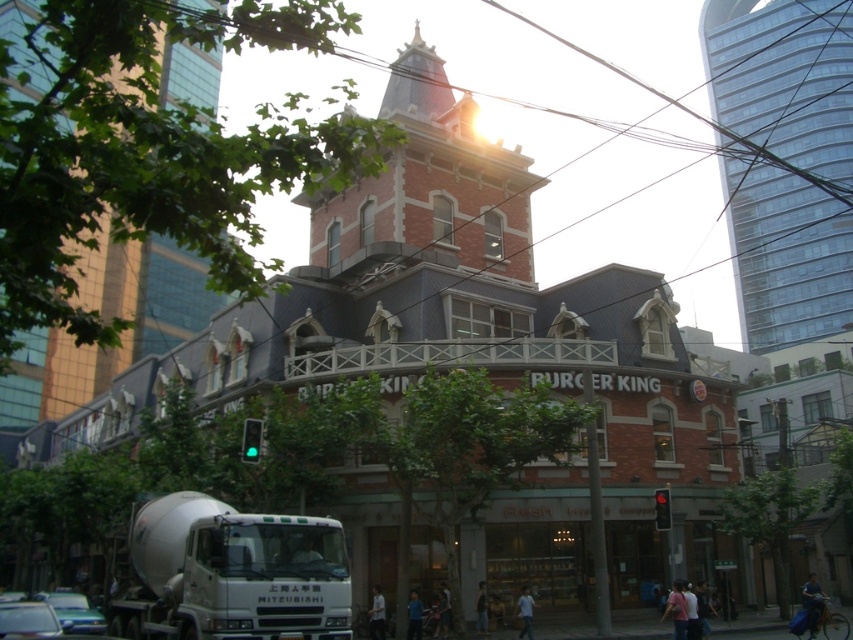
Question: Which object is positioned farthest from the transparent glass tower at upper right?

Choices:
 (A) white matte shirt at lower center
 (B) blue fabric shirt at lower center

Answer: (A)

Question: Can you confirm if white matte shirt at lower center is bigger than light brown leather jacket at lower center?

Choices:
 (A) no
 (B) yes

Answer: (A)

Question: Is white matte shirt at lower center positioned before blue fabric shirt at lower center?

Choices:
 (A) yes
 (B) no

Answer: (B)

Question: Which of these objects is positioned closest to the blue denim jeans at lower right?

Choices:
 (A) blue fabric shirt at lower center
 (B) white matte shirt at lower center

Answer: (A)

Question: Which object is closer to the camera taking this photo?

Choices:
 (A) blue fabric shirt at lower center
 (B) blue denim jeans at lower right
 (C) light brown leather jacket at lower center

Answer: (B)

Question: Is transparent glass tower at upper right positioned behind white matte shirt at lower center?

Choices:
 (A) no
 (B) yes

Answer: (B)